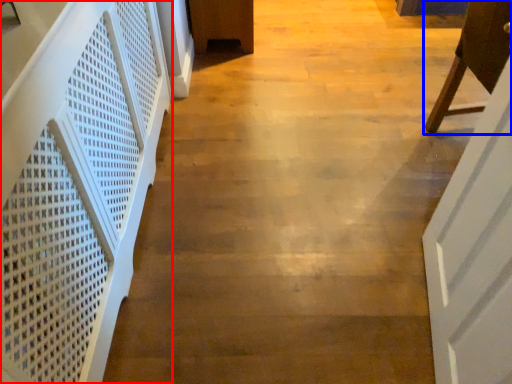
Question: Which point is further to the camera, stairwell (highlighted by a red box) or furniture (highlighted by a blue box)?

Choices:
 (A) stairwell
 (B) furniture

Answer: (B)